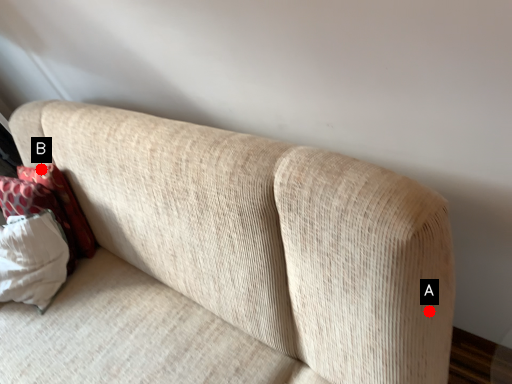
Question: Two points are circled on the image, labeled by A and B beside each circle. Which point is closer to the camera taking this photo?

Choices:
 (A) A is closer
 (B) B is closer

Answer: (A)